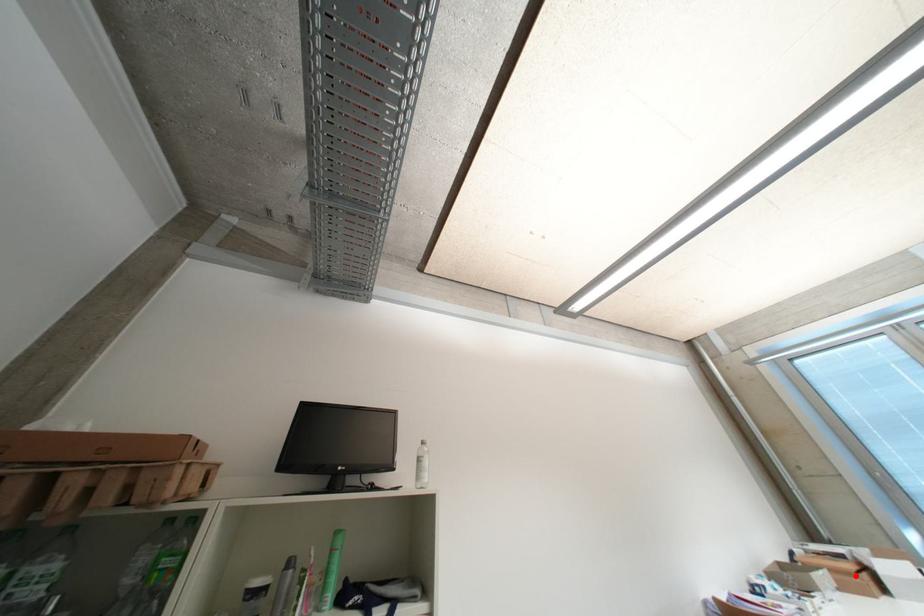
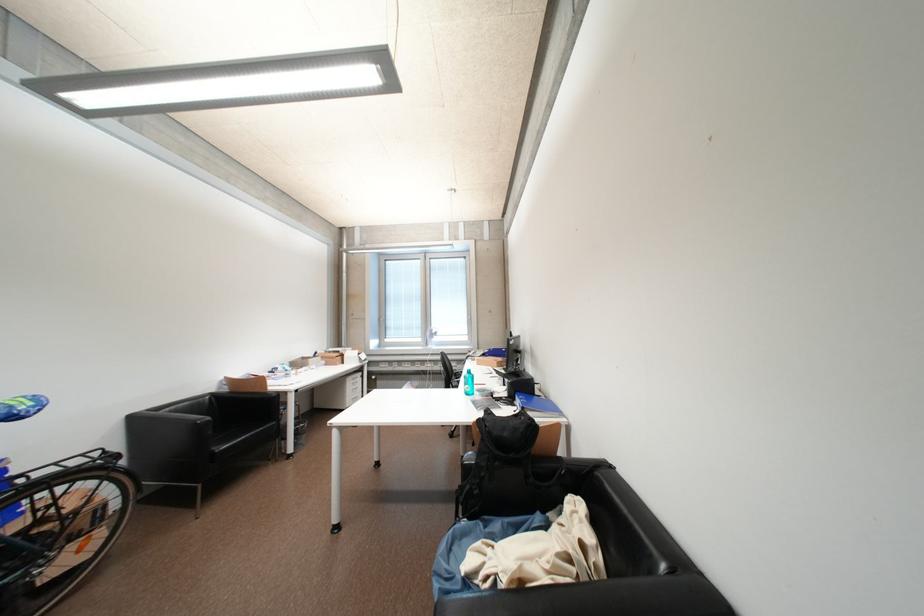
Question: I am providing you with two images of the same scene from different viewpoints. Given a red point in image1, look at the same physical point in image2. Is it:

Choices:
 (A) Closer to the viewpoint
 (B) Farther from the viewpoint

Answer: (B)